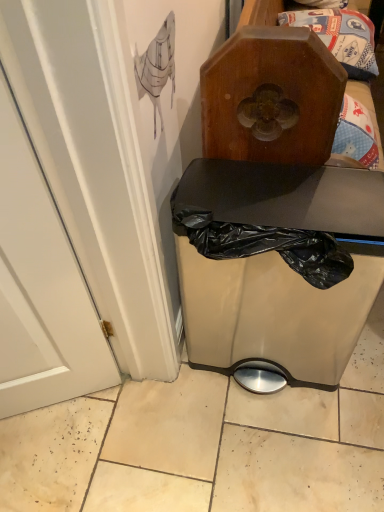
Question: From a real-world perspective, relative to wooden box at upper center, is matte black trash can at center vertically above or below?

Choices:
 (A) below
 (B) above

Answer: (A)

Question: Which is correct: matte black trash can at center is inside wooden box at upper center, or outside of it?

Choices:
 (A) inside
 (B) outside

Answer: (B)

Question: Considering the positions of matte black trash can at center and wooden box at upper center in the image, is matte black trash can at center wider or thinner than wooden box at upper center?

Choices:
 (A) thin
 (B) wide

Answer: (B)

Question: In terms of size, does wooden box at upper center appear bigger or smaller than matte black trash can at center?

Choices:
 (A) big
 (B) small

Answer: (B)

Question: From a real-world perspective, is wooden box at upper center physically located above or below matte black trash can at center?

Choices:
 (A) below
 (B) above

Answer: (B)

Question: Is wooden box at upper center to the left or to the right of matte black trash can at center in the image?

Choices:
 (A) right
 (B) left

Answer: (B)

Question: Looking at their shapes, would you say wooden box at upper center is wider or thinner than matte black trash can at center?

Choices:
 (A) wide
 (B) thin

Answer: (B)